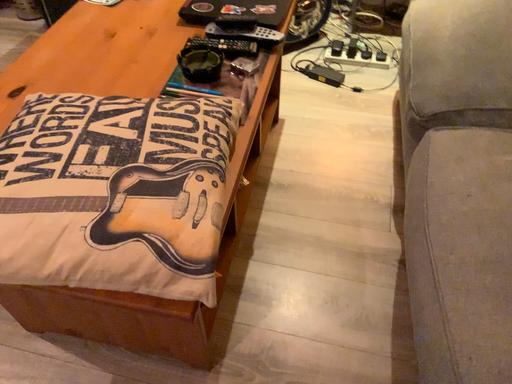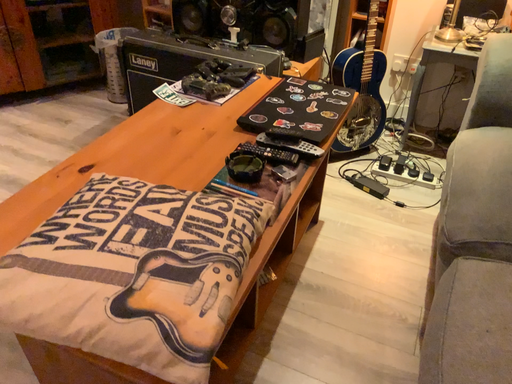
Question: How did the camera likely rotate when shooting the video?

Choices:
 (A) rotated downward
 (B) rotated upward

Answer: (B)